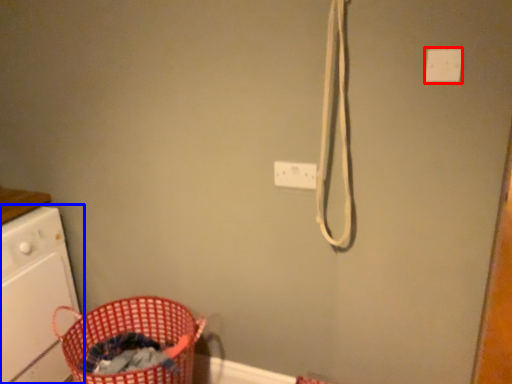
Question: Which of the following is the farthest to the observer, light switch (highlighted by a red box) or home appliance (highlighted by a blue box)?

Choices:
 (A) light switch
 (B) home appliance

Answer: (B)